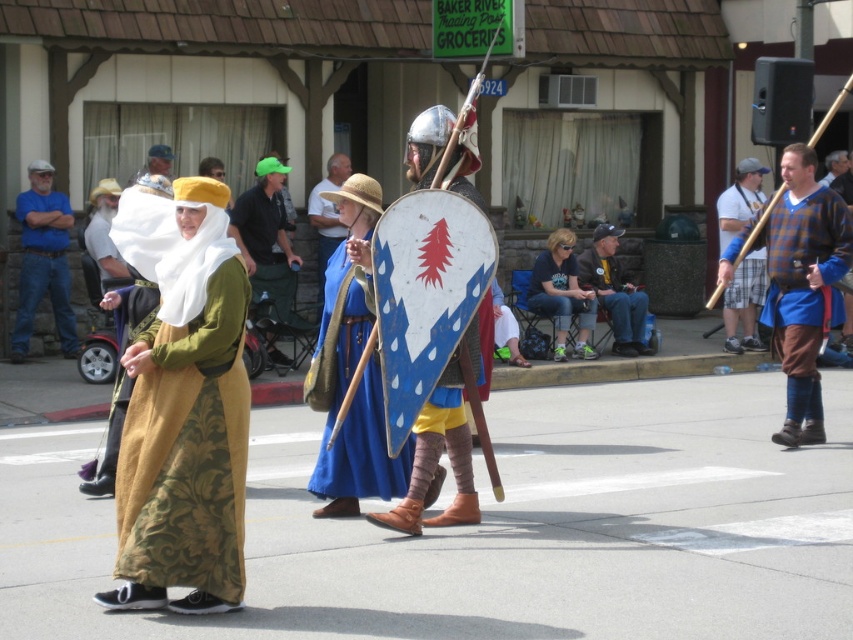
Is blue fabric shield at center in front of matte gold helmet at center?

Yes, blue fabric shield at center is in front of matte gold helmet at center.

Which of these two, blue fabric shield at center or matte gold helmet at center, stands shorter?

matte gold helmet at center is shorter.

Which is behind, point (323, 440) or point (160, 154)?

Point (160, 154)

Where is `blue fabric shield at center`? This screenshot has width=853, height=640. blue fabric shield at center is located at coordinates (358, 420).

Which is more to the left, blue plaid shirt at right or matte gold helmet at center?

From the viewer's perspective, matte gold helmet at center appears more on the left side.

Is blue plaid shirt at right thinner than matte gold helmet at center?

Indeed, blue plaid shirt at right has a lesser width compared to matte gold helmet at center.

Is point (740, 289) positioned in front of point (165, 150)?

No, it is behind (165, 150).

This screenshot has height=640, width=853. In order to click on blue plaid shirt at right in this screenshot , I will do `click(744, 304)`.

Is point (734, 193) positioned before point (544, 300)?

No, it is behind (544, 300).

The image size is (853, 640). Describe the element at coordinates (744, 304) in the screenshot. I see `blue plaid shirt at right` at that location.

Is point (727, 337) behind point (554, 307)?

Yes, it is behind point (554, 307).

At what (x,y) coordinates should I click in order to perform the action: click on blue plaid shirt at right. Please return your answer as a coordinate pair (x, y). The height and width of the screenshot is (640, 853). Looking at the image, I should click on (744, 304).